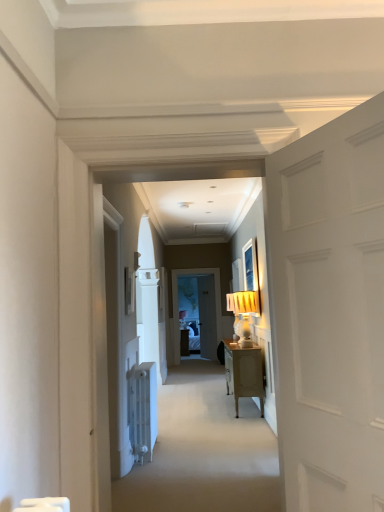
Question: Does carpet at center have a lesser height compared to white matte door at right?

Choices:
 (A) yes
 (B) no

Answer: (A)

Question: From the image's perspective, is carpet at center located above white matte door at right?

Choices:
 (A) no
 (B) yes

Answer: (A)

Question: Is carpet at center in front of white matte door at right?

Choices:
 (A) no
 (B) yes

Answer: (A)

Question: From the image's perspective, is carpet at center located beneath white matte door at right?

Choices:
 (A) yes
 (B) no

Answer: (A)

Question: Does carpet at center turn towards white matte door at right?

Choices:
 (A) no
 (B) yes

Answer: (A)

Question: Is matte white picture frame at upper left to the left or to the right of carpet at center in the image?

Choices:
 (A) left
 (B) right

Answer: (A)

Question: Considering their positions, is matte white picture frame at upper left located in front of or behind carpet at center?

Choices:
 (A) front
 (B) behind

Answer: (B)

Question: Based on their sizes in the image, would you say matte white picture frame at upper left is bigger or smaller than carpet at center?

Choices:
 (A) big
 (B) small

Answer: (B)

Question: From the image's perspective, is matte white picture frame at upper left located above or below carpet at center?

Choices:
 (A) above
 (B) below

Answer: (A)

Question: Is carpet at center spatially inside white matte door at right, or outside of it?

Choices:
 (A) outside
 (B) inside

Answer: (A)

Question: In terms of width, does carpet at center look wider or thinner when compared to white matte door at right?

Choices:
 (A) thin
 (B) wide

Answer: (B)

Question: From a real-world perspective, relative to white matte door at right, is carpet at center vertically above or below?

Choices:
 (A) above
 (B) below

Answer: (B)

Question: Is point (221, 370) closer or farther from the camera than point (309, 406)?

Choices:
 (A) farther
 (B) closer

Answer: (A)

Question: Is point (337, 196) positioned closer to the camera than point (125, 288)?

Choices:
 (A) closer
 (B) farther

Answer: (A)

Question: From the image's perspective, is white matte door at right above or below matte white picture frame at upper left?

Choices:
 (A) above
 (B) below

Answer: (A)